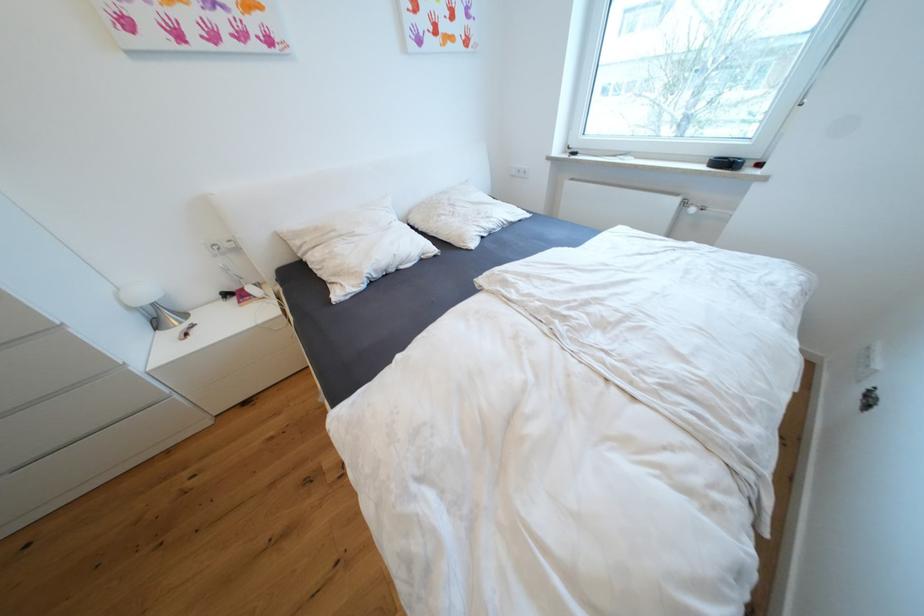
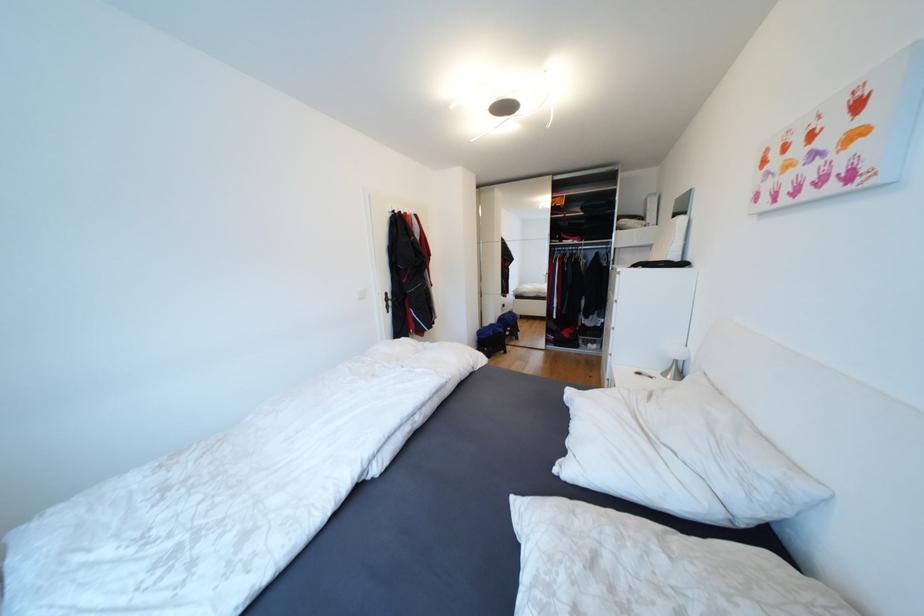
In the second image, find the point that corresponds to (348,305) in the first image.

(570, 394)